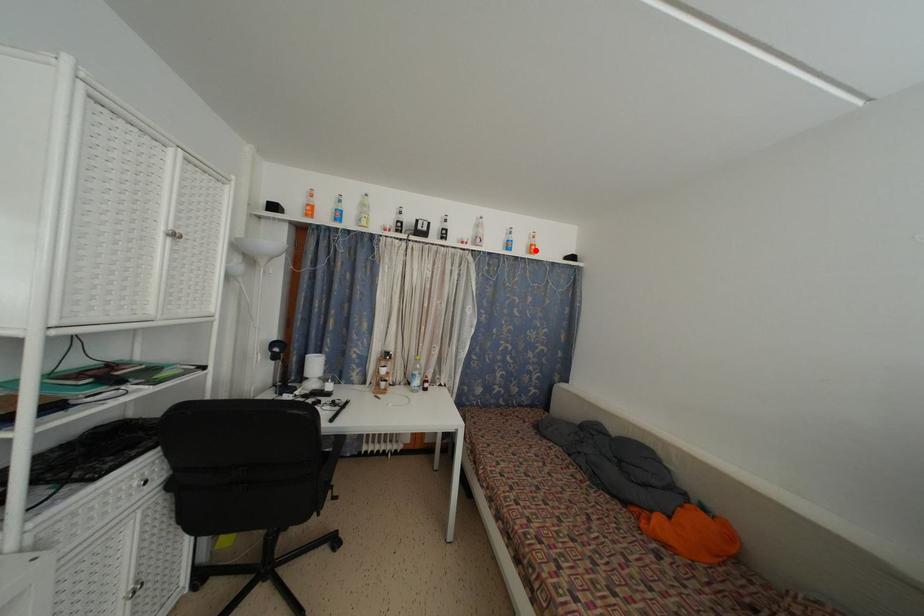
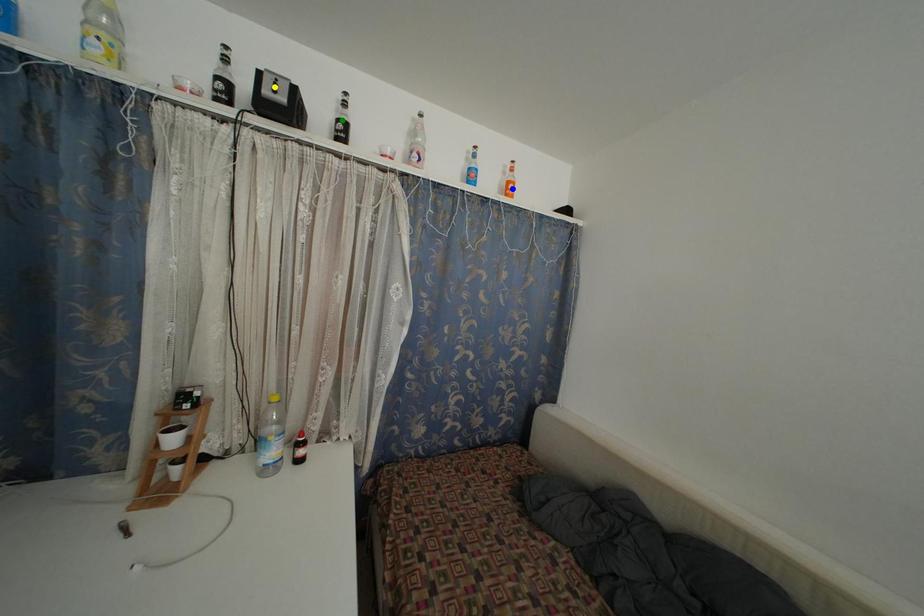
Question: I am providing you with two images of the same scene from different viewpoints. A red point is marked on the first image. You are given multiple points on the second image. Can you choose the point in image 2 that corresponds to the point in image 1?

Choices:
 (A) green point
 (B) yellow point
 (C) blue point

Answer: (C)